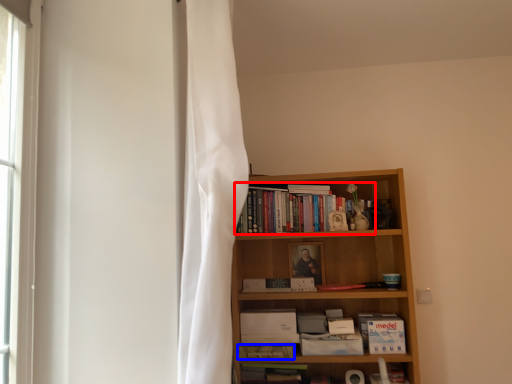
Question: Which object is further to the camera taking this photo, book (highlighted by a red box) or paperback book (highlighted by a blue box)?

Choices:
 (A) book
 (B) paperback book

Answer: (A)